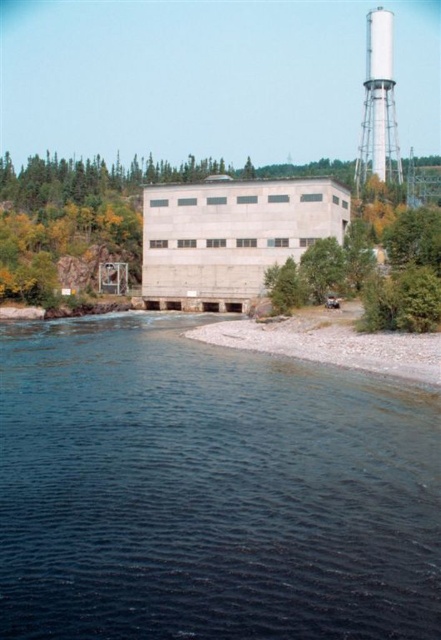
Who is higher up, dark blue water at lower center or smooth gravel shoreline at lower right?

smooth gravel shoreline at lower right is above.

Is point (225, 550) positioned in front of point (296, 316)?

Yes.

Locate an element on the screen. dark blue water at lower center is located at coordinates (209, 490).

Measure the distance from dark blue water at lower center to white smooth water tower at upper right.

The distance of dark blue water at lower center from white smooth water tower at upper right is 585.98 feet.

Which is more to the left, dark blue water at lower center or white smooth water tower at upper right?

Positioned to the left is dark blue water at lower center.

Does point (187, 387) lie behind point (387, 140)?

That is False.

Locate an element on the screen. This screenshot has width=441, height=640. dark blue water at lower center is located at coordinates (209, 490).

Can you confirm if smooth gravel shoreline at lower right is thinner than white smooth water tower at upper right?

Yes.

The width and height of the screenshot is (441, 640). I want to click on smooth gravel shoreline at lower right, so click(x=331, y=342).

Locate an element on the screen. This screenshot has height=640, width=441. smooth gravel shoreline at lower right is located at coordinates (331, 342).